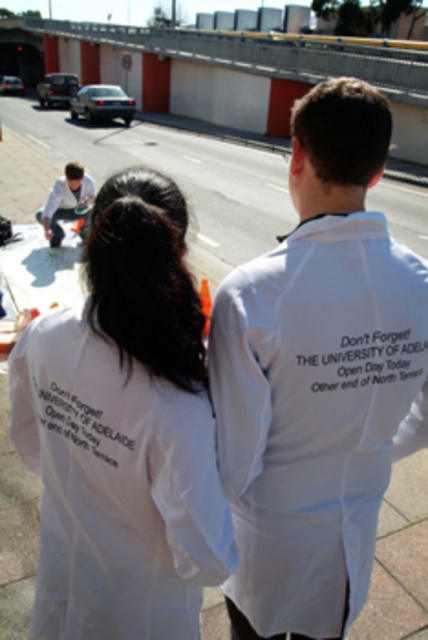
Does white cotton shirt at center have a greater height compared to matte white shirt at lower left?

Correct, white cotton shirt at center is much taller as matte white shirt at lower left.

Which is behind, point (115, 307) or point (42, 218)?

The point (42, 218) is behind.

In the scene shown: Who is more forward, (x=92, y=216) or (x=47, y=220)?

Positioned in front is point (x=92, y=216).

Identify the location of white cotton shirt at center. (124, 433).

Does white cotton hoodie at upper right have a greater height compared to white cotton shirt at center?

Correct, white cotton hoodie at upper right is much taller as white cotton shirt at center.

At what (x,y) coordinates should I click in order to perform the action: click on white cotton hoodie at upper right. Please return your answer as a coordinate pair (x, y). Image resolution: width=428 pixels, height=640 pixels. Looking at the image, I should click on (315, 378).

Where is `white cotton hoodie at upper right`? The width and height of the screenshot is (428, 640). white cotton hoodie at upper right is located at coordinates (315, 378).

Looking at this image, between white cotton hoodie at upper right and matte white shirt at lower left, which one appears on the left side from the viewer's perspective?

From the viewer's perspective, matte white shirt at lower left appears more on the left side.

Which is behind, point (350, 579) or point (56, 196)?

Point (56, 196)

Locate an element on the screen. white cotton hoodie at upper right is located at coordinates (315, 378).